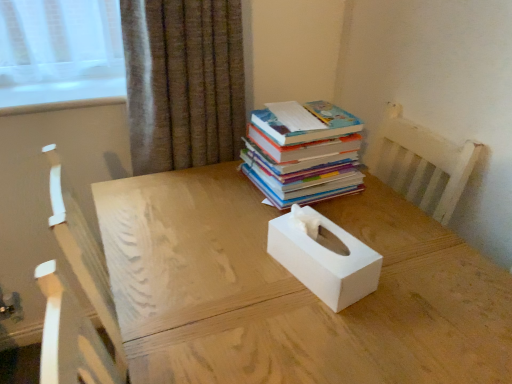
The height and width of the screenshot is (384, 512). What are the coordinates of `vacant area that is in front of white matte tissue box at center` in the screenshot? It's located at (325, 333).